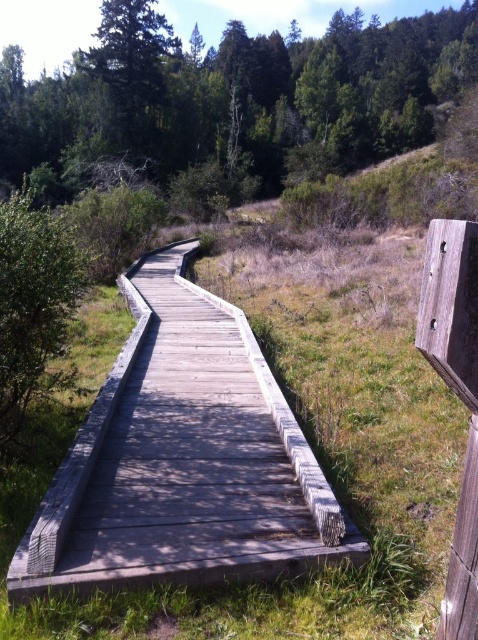
In the scene shown: You are standing at the edge of the boardwalk and want to reach the point marked as point (183, 460). Based on the scene description, where exactly is this point located?

The point (183, 460) is located on the gray wooden boardwalk at center.

You are a hiker walking along the gray wooden boardwalk at center and notice the green leafy bush at left. Which object is closer to the ground?

The gray wooden boardwalk at center is positioned under the green leafy bush at left, meaning the boardwalk is closer to the ground than the bush.

You are a hiker standing on the gray wooden boardwalk at center. You notice the green leafy tree at upper center nearby. Which object has a narrower width?

The gray wooden boardwalk at center is thinner than the green leafy tree at upper center, so the gray wooden boardwalk at center has a narrower width.